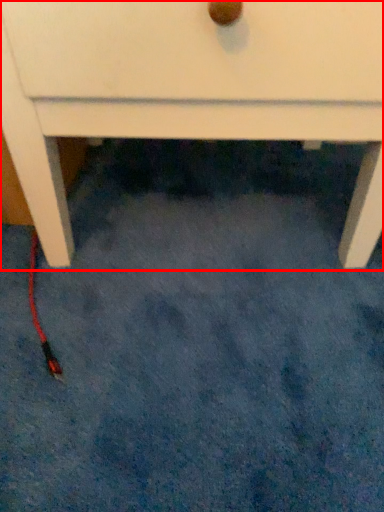
Question: From the image's perspective, where is chest of drawers (annotated by the red box) located in relation to cable in the image?

Choices:
 (A) below
 (B) above

Answer: (B)